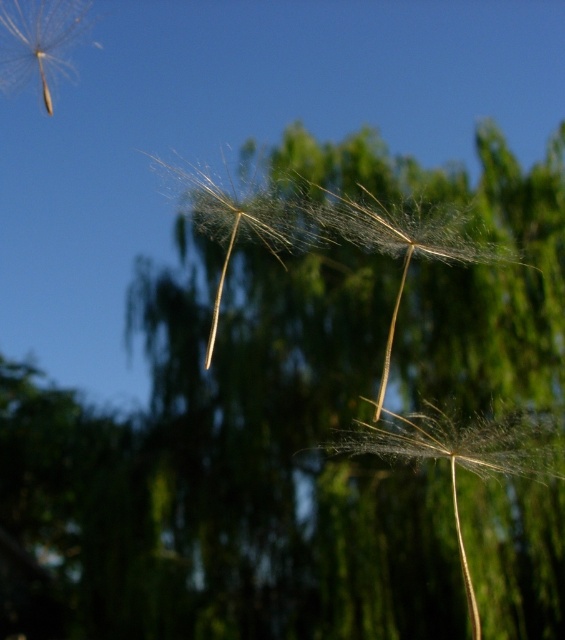
You are a botanist studying dandelion seed heads. You observe the translucent fibrous dandelion at center and the transparent white dandelion at upper left in the image. Which of these two dandelions has a greater height?

The translucent fibrous dandelion at center is much taller than the transparent white dandelion at upper left, so it has a greater height.

You are a botanist examining two dandelion seed heads in the image. The translucent fibrous dandelion at center and the transparent white dandelion at upper left. Which one has a greater number of seeds based on their size?

The translucent fibrous dandelion at center is larger in size than the transparent white dandelion at upper left, so it likely has a greater number of seeds.

You are a photographer trying to capture the translucent fibrous dandelion at center and the translucent white dandelion at center in focus. Which one should you focus on to ensure it appears sharp in the photo?

You should focus on the translucent white dandelion at center because the translucent fibrous dandelion at center is positioned under it, making it closer to the camera.